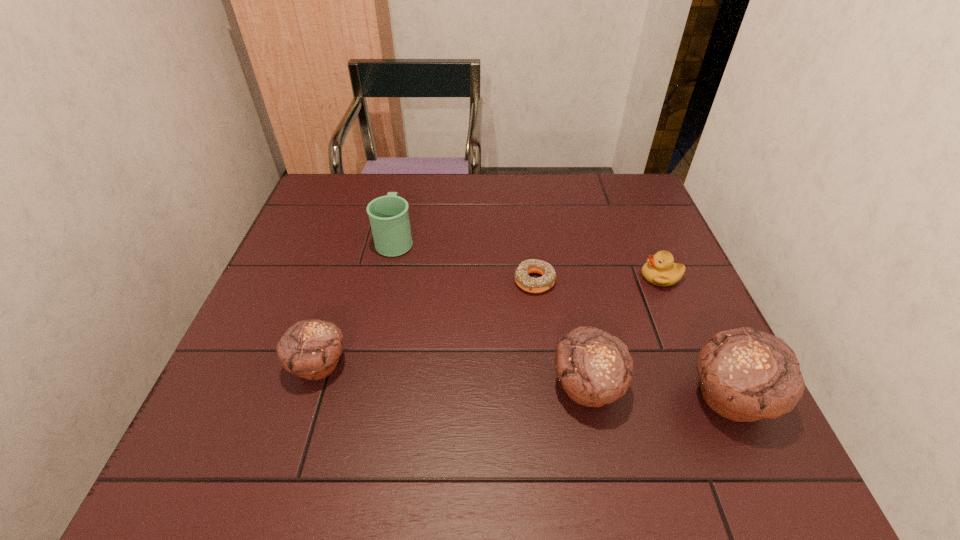
This screenshot has height=540, width=960. In order to click on object located in the near left corner section of the desktop in this screenshot , I will do `click(311, 349)`.

You are a GUI agent. You are given a task and a screenshot of the screen. Output one action in this format:
    pyautogui.click(x=<x>, y=<y>)
    Task: Click on the object at the near right corner
    
    Given the screenshot: What is the action you would take?
    pyautogui.click(x=745, y=374)

In the image, there is a desktop. Where is `vacant area at the far edge`? This screenshot has height=540, width=960. vacant area at the far edge is located at coordinates (461, 188).

At what (x,y) coordinates should I click in order to perform the action: click on free space at the near edge. Please return your answer as a coordinate pair (x, y). This screenshot has height=540, width=960. Looking at the image, I should click on (492, 407).

Where is `vacant space at the left edge of the desktop`? vacant space at the left edge of the desktop is located at coordinates tap(320, 228).

This screenshot has width=960, height=540. In the image, there is a desktop. Find the location of `vacant space at the right edge`. vacant space at the right edge is located at coordinates (627, 286).

You are a GUI agent. You are given a task and a screenshot of the screen. Output one action in this format:
    pyautogui.click(x=<x>, y=<y>)
    Task: Click on the vacant space at the far left corner
    The height and width of the screenshot is (540, 960).
    Given the screenshot: What is the action you would take?
    pyautogui.click(x=343, y=176)

In the image, there is a desktop. Identify the location of vacant space at the far right corner. (601, 194).

Locate an element on the screen. The image size is (960, 540). vacant space at the near right corner of the desktop is located at coordinates (689, 409).

This screenshot has height=540, width=960. I want to click on vacant area that lies between the second shortest muffin and the fifth tallest object, so click(x=624, y=332).